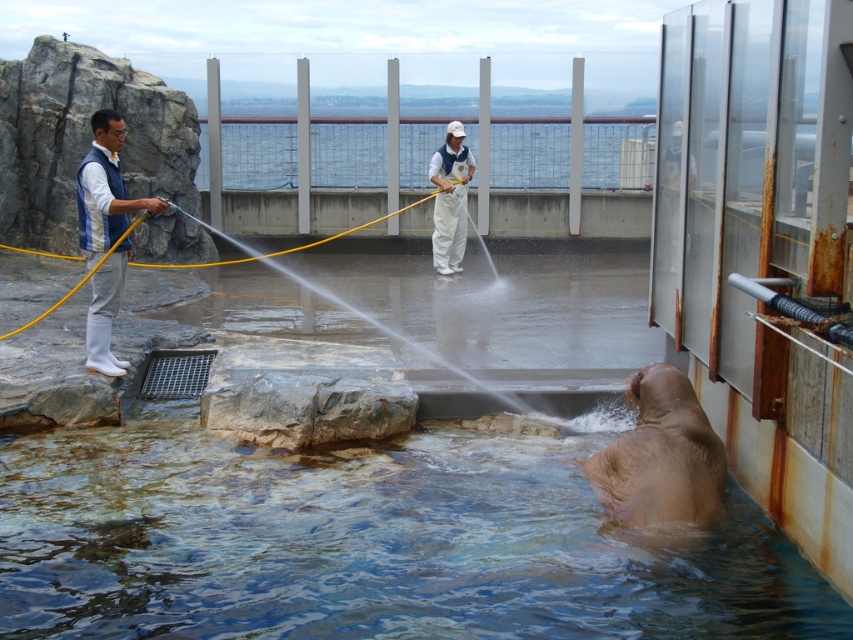
You are a zookeeper observing the scene. There is a white matte uniform at center and a yellow rubber hose at left. Which object is positioned to the right of the other?

The white matte uniform at center is to the right of the yellow rubber hose at left.

You are a zookeeper responsible for ensuring the safety of the walrus. You notice two individuals spraying water at it with hoses. Based on the scene, can you determine if the white matte uniform at center is positioned closer to the walrus than the glass barrier separating visitors from the animals?

The white matte uniform at center is located at point [450,198], which is closer to the walrus than the glass barrier, so the zookeeper should ensure they maintain a safe distance for both the staff and the animal.